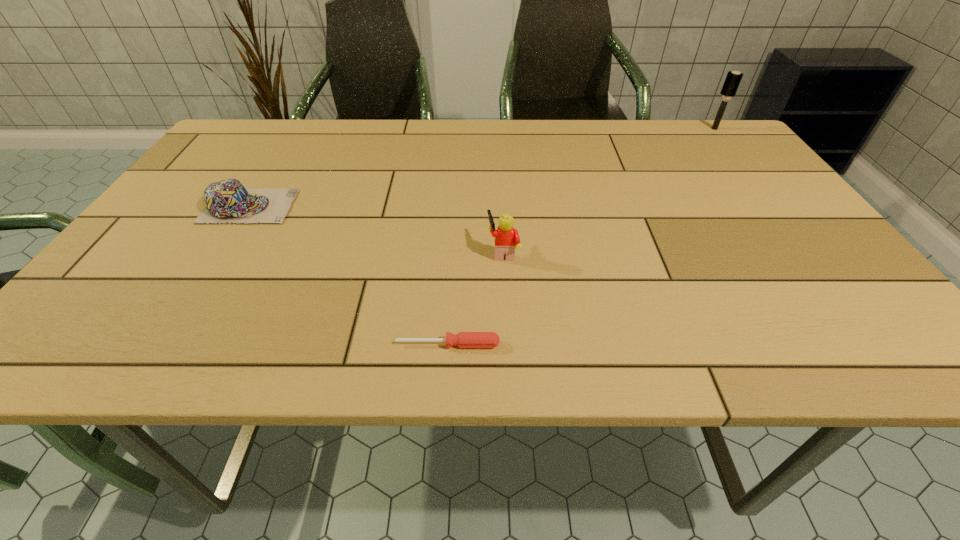
I want to click on vacant area that lies between the screwdriver and the second nearest object, so click(x=475, y=298).

Locate an element on the screen. free space between the screwdriver and the tallest object is located at coordinates (581, 237).

Identify the location of vacant space in between the cap and the shortest object. (348, 275).

Identify the location of empty space that is in between the leftmost object and the shortest object. The height and width of the screenshot is (540, 960). (348, 275).

Find the location of `vacant point located between the second farthest object and the shortest object`. vacant point located between the second farthest object and the shortest object is located at coordinates (348, 275).

Where is `vacant area that lies between the Lego and the cap`? The height and width of the screenshot is (540, 960). vacant area that lies between the Lego and the cap is located at coordinates tap(376, 229).

Choose which object is the nearest neighbor to the nearest object. Please provide its 2D coordinates. Your answer should be formatted as a tuple, i.e. [(x, y)], where the tuple contains the x and y coordinates of a point satisfying the conditions above.

[(507, 239)]

Locate an element on the screen. This screenshot has height=540, width=960. the closest object relative to the leftmost object is located at coordinates (463, 339).

You are a GUI agent. You are given a task and a screenshot of the screen. Output one action in this format:
    pyautogui.click(x=<x>, y=<y>)
    Task: Click on the free location that satisfies the following two spatial constraints: 1. on the back side of the screwdriver; 2. on the front, side, and top of the third tallest object
    
    Given the screenshot: What is the action you would take?
    tap(457, 206)

You are a GUI agent. You are given a task and a screenshot of the screen. Output one action in this format:
    pyautogui.click(x=<x>, y=<y>)
    Task: Click on the vacant space that satisfies the following two spatial constraints: 1. on the front, side, and top of the leftmost object; 2. on the right side of the shortest object
    Image resolution: width=960 pixels, height=540 pixels.
    Given the screenshot: What is the action you would take?
    pyautogui.click(x=163, y=345)